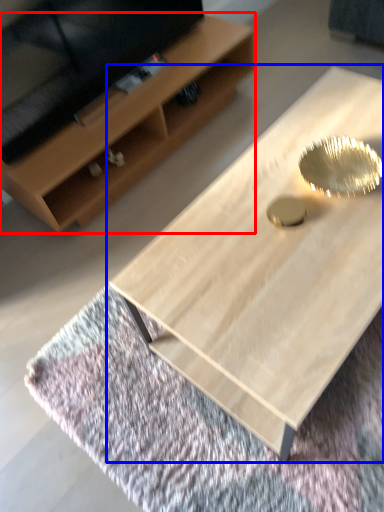
Question: Among these objects, which one is farthest to the camera, shelf (highlighted by a red box) or coffee table (highlighted by a blue box)?

Choices:
 (A) shelf
 (B) coffee table

Answer: (A)